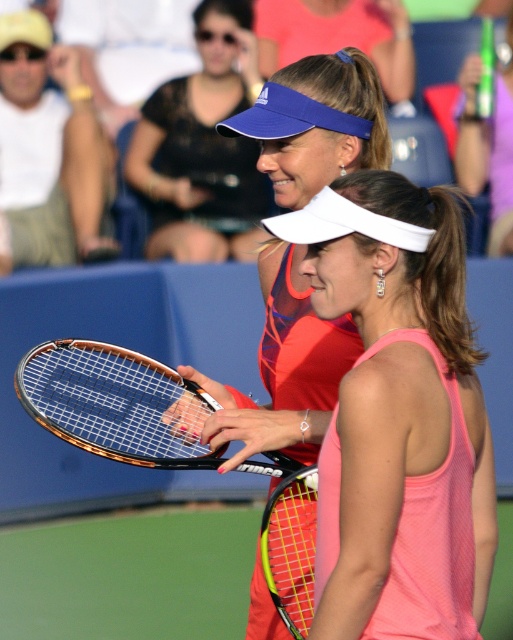
You are a tennis coach observing the two players on the court. You notice a specific point marked at coordinates (399,417). Which player is this point located on?

The point at coordinates (399,417) is located on the pink fabric tennis dress at center, which belongs to the player in the foreground wearing a pink sleeveless top and white visor.